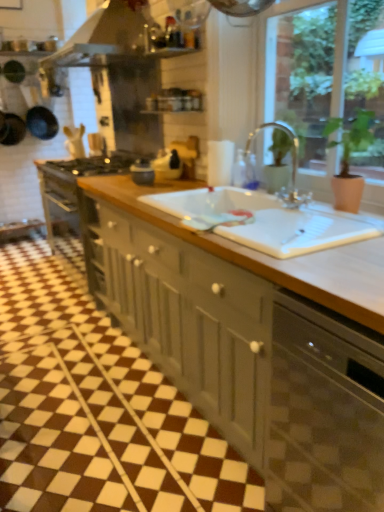
Question: From the image's perspective, is matte gray cabinets at center located above or below green matte plant at upper right?

Choices:
 (A) above
 (B) below

Answer: (B)

Question: From a real-world perspective, relative to green matte plant at upper right, is matte gray cabinets at center vertically above or below?

Choices:
 (A) above
 (B) below

Answer: (B)

Question: Estimate the real-world distances between objects in this image. Which object is closer to the metallic silver exhaust hood at upper center?

Choices:
 (A) satin black dishwasher at lower right
 (B) clear glass faucet at upper center
 (C) matte gray cabinets at center
 (D) green matte plant at upper right

Answer: (D)

Question: Which of these objects is positioned farthest from the satin black dishwasher at lower right?

Choices:
 (A) metallic silver exhaust hood at upper center
 (B) green matte plant at upper right
 (C) matte gray cabinets at center
 (D) clear glass faucet at upper center

Answer: (A)